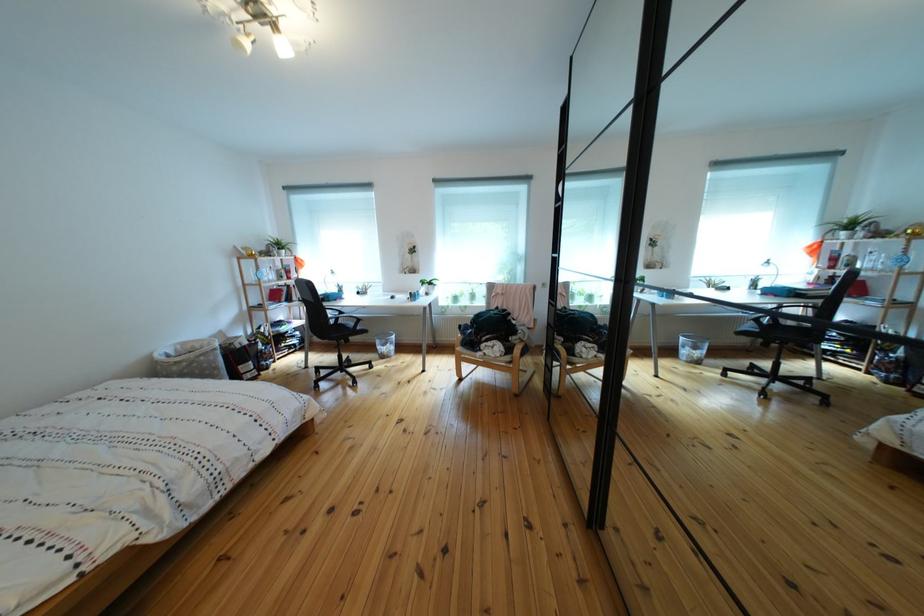
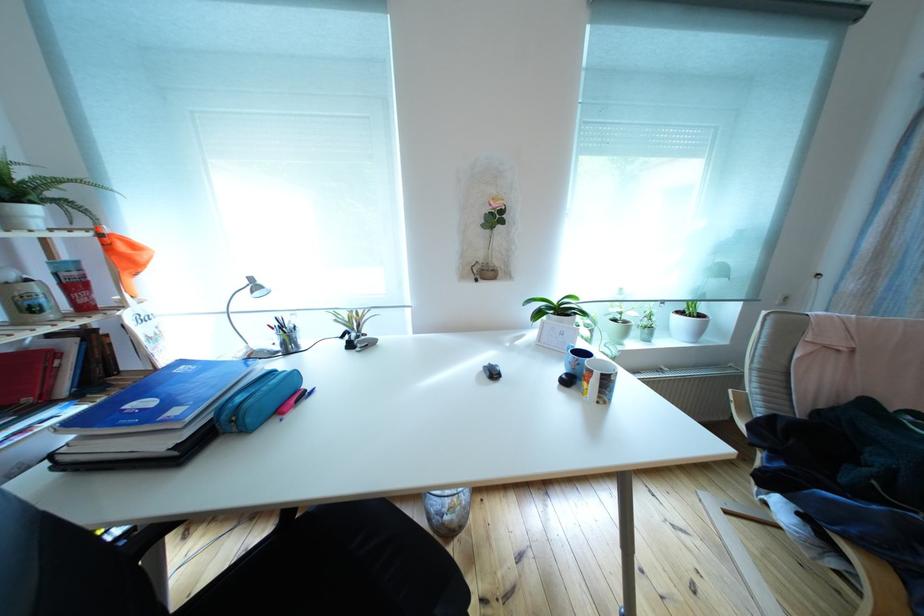
What movement of the cameraman would produce the second image?

The cameraman walked toward left, forward.